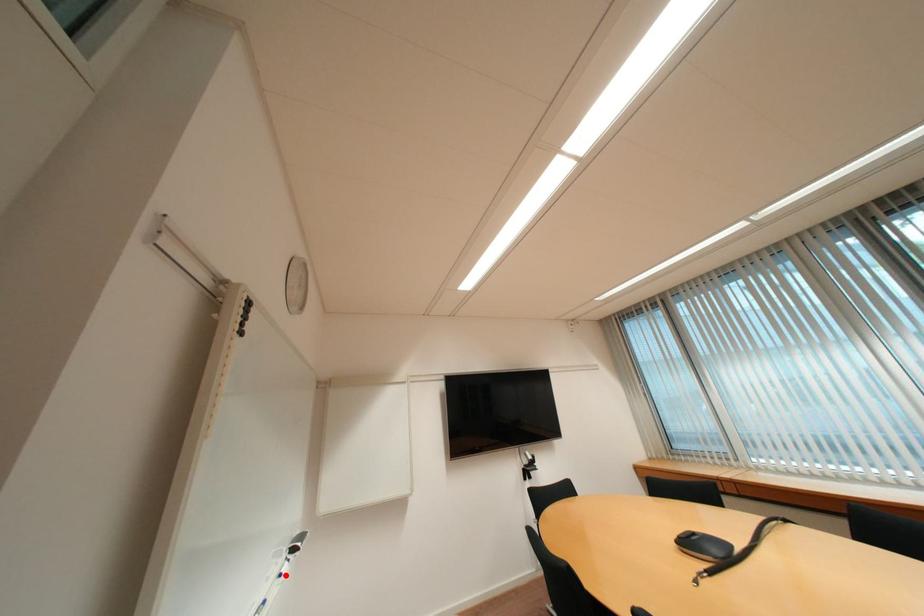
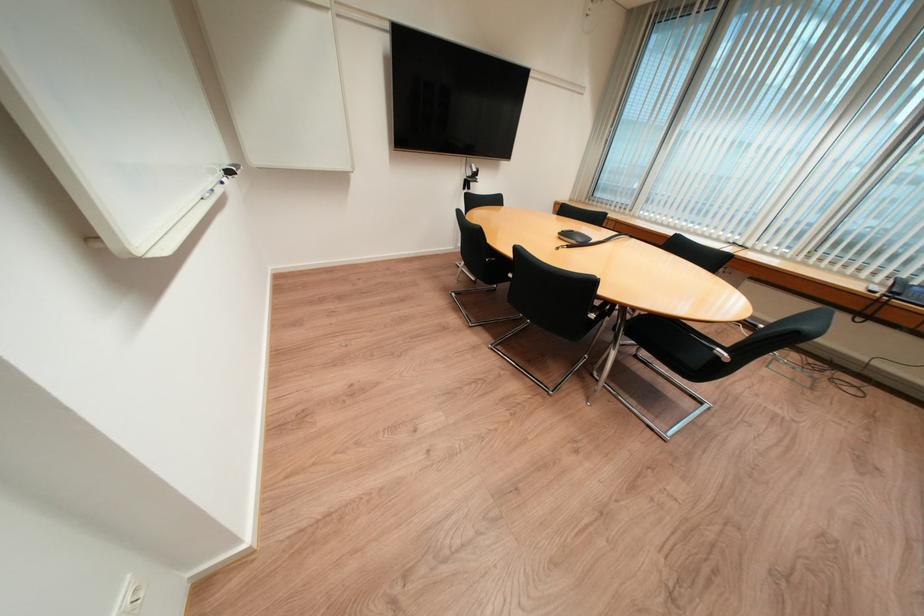
Where in the second image is the point corresponding to the highlighted location from the first image?

(225, 180)